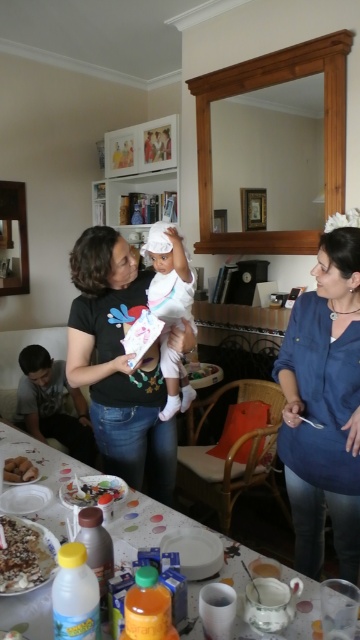
You are a guest at the party and want to place a small gift on the smooth plastic tray at lower center without covering the matte black shirt at center. Where should you place the gift on the tray?

Place the gift on the right side of the smooth plastic tray at lower center since the matte black shirt at center is to the left of the tray, leaving space on the right.